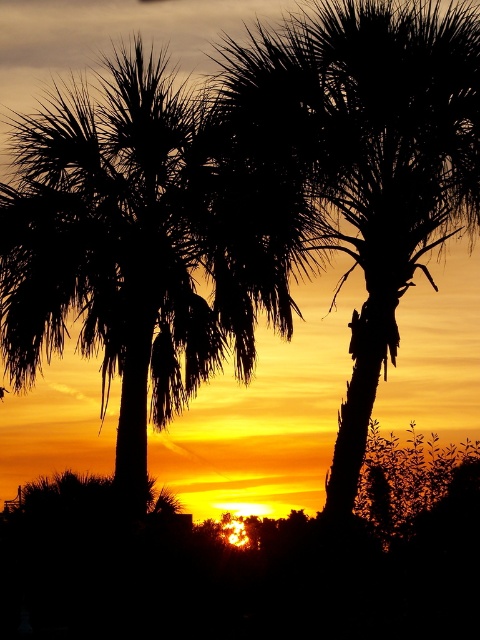
Which is more to the left, black silhouette palm tree at left or black textured palm tree at center?

black silhouette palm tree at left is more to the left.

Between black silhouette palm tree at left and black textured palm tree at center, which one has less height?

With less height is black textured palm tree at center.

Who is more distant from viewer, (127, 420) or (372, 342)?

Positioned behind is point (127, 420).

Where is `black silhouette palm tree at left`? The image size is (480, 640). black silhouette palm tree at left is located at coordinates (140, 244).